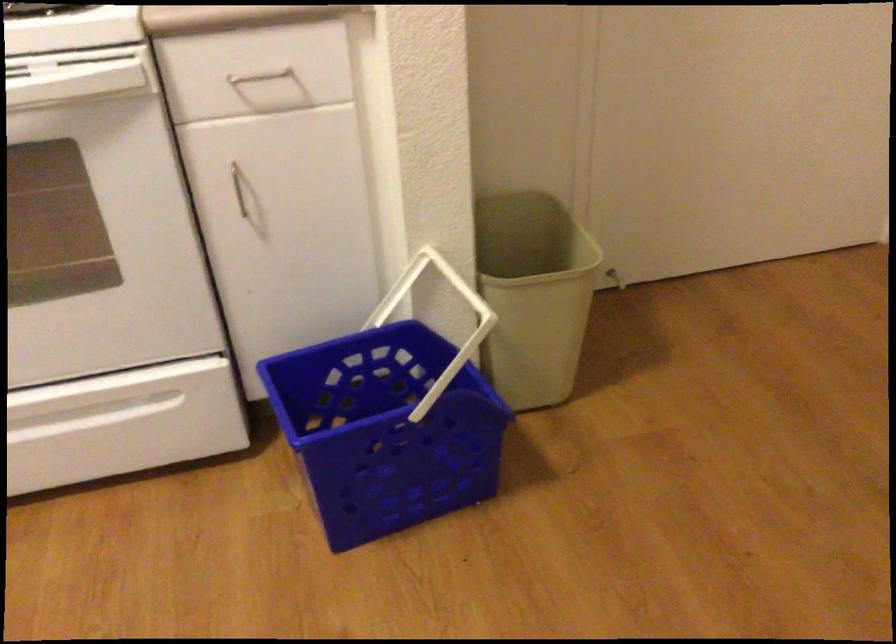
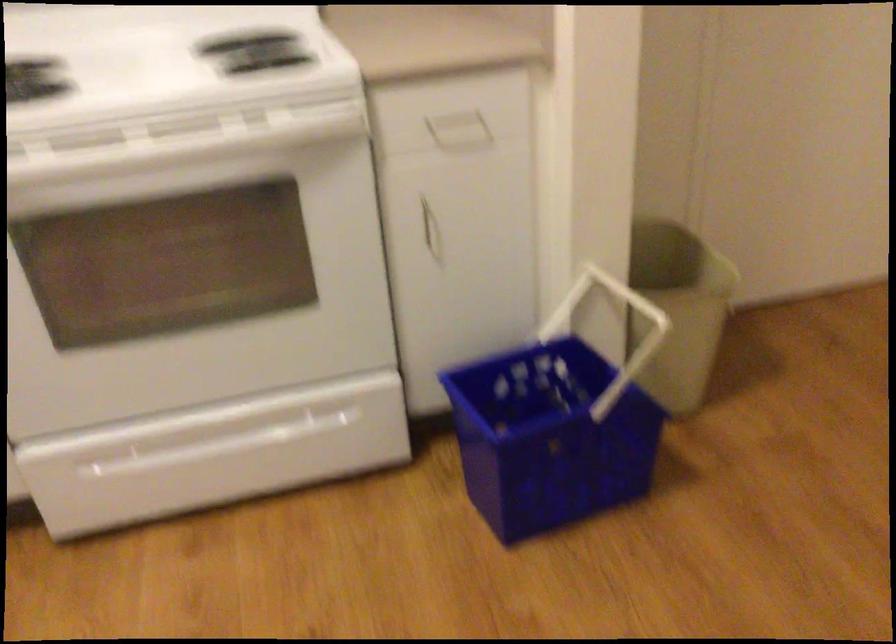
Where in the second image is the point corresponding to pixel 254 212 from the first image?

(431, 234)